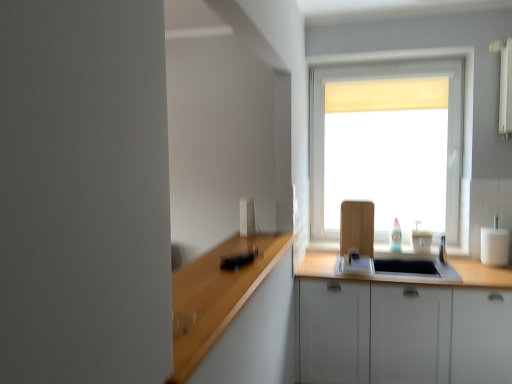
Question: Considering the relative sizes of white matte window at center and white glossy toaster at upper center, the first appliance when ordered from front to back, in the image provided, is white matte window at center smaller than white glossy toaster at upper center, the first appliance when ordered from front to back,?

Choices:
 (A) no
 (B) yes

Answer: (A)

Question: Considering the relative sizes of white matte window at center and white glossy toaster at upper center, the first appliance when ordered from front to back, in the image provided, is white matte window at center wider than white glossy toaster at upper center, the first appliance when ordered from front to back,?

Choices:
 (A) no
 (B) yes

Answer: (A)

Question: Does white matte window at center appear on the left side of white glossy toaster at upper center, which is counted as the second appliance, starting from the right?

Choices:
 (A) no
 (B) yes

Answer: (A)

Question: Considering the relative sizes of white matte window at center and white glossy toaster at upper center, the first appliance when ordered from front to back, in the image provided, is white matte window at center thinner than white glossy toaster at upper center, the first appliance when ordered from front to back,?

Choices:
 (A) no
 (B) yes

Answer: (B)

Question: Is white matte window at center touching white glossy toaster at upper center, marked as the second appliance in a back-to-front arrangement?

Choices:
 (A) yes
 (B) no

Answer: (B)

Question: Considering the positions of white matte cabinet at lower right and white glossy sink at center in the image, is white matte cabinet at lower right wider or thinner than white glossy sink at center?

Choices:
 (A) wide
 (B) thin

Answer: (A)

Question: Is white matte cabinet at lower right to the left or to the right of white glossy sink at center in the image?

Choices:
 (A) right
 (B) left

Answer: (A)

Question: Is point (482, 302) positioned closer to the camera than point (384, 259)?

Choices:
 (A) closer
 (B) farther

Answer: (A)

Question: From a real-world perspective, is white matte cabinet at lower right physically located above or below white glossy sink at center?

Choices:
 (A) below
 (B) above

Answer: (A)

Question: Considering their positions, is white matte window at center located in front of or behind white glossy toaster at upper center, marked as the second appliance in a back-to-front arrangement?

Choices:
 (A) behind
 (B) front

Answer: (A)

Question: Is white matte window at center inside the boundaries of white glossy toaster at upper center, the first appliance when ordered from front to back, or outside?

Choices:
 (A) inside
 (B) outside

Answer: (B)

Question: Considering the positions of white matte window at center and white glossy toaster at upper center, which is counted as the second appliance, starting from the right, in the image, is white matte window at center wider or thinner than white glossy toaster at upper center, which is counted as the second appliance, starting from the right,?

Choices:
 (A) thin
 (B) wide

Answer: (A)

Question: From their relative heights in the image, would you say white matte window at center is taller or shorter than white glossy toaster at upper center, marked as the second appliance in a back-to-front arrangement?

Choices:
 (A) tall
 (B) short

Answer: (A)

Question: From the image's perspective, relative to white glossy cup at right, which is the second appliance in front-to-back order, is white matte cabinet at lower right above or below?

Choices:
 (A) below
 (B) above

Answer: (A)

Question: In the image, is white matte cabinet at lower right positioned in front of or behind white glossy cup at right, which is the second appliance in front-to-back order?

Choices:
 (A) behind
 (B) front

Answer: (B)